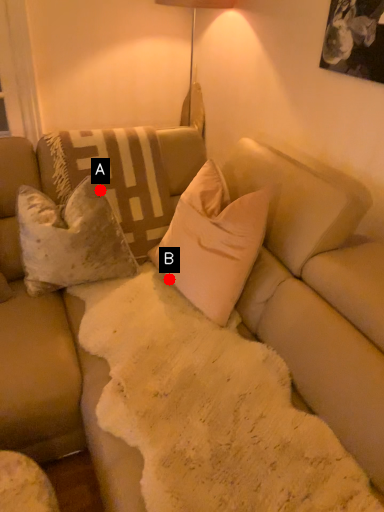
Question: Two points are circled on the image, labeled by A and B beside each circle. Which point is farther from the camera taking this photo?

Choices:
 (A) A is further
 (B) B is further

Answer: (A)